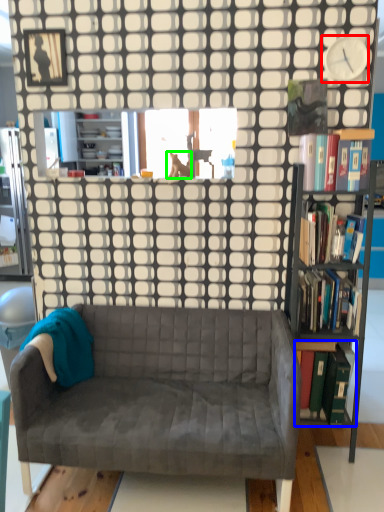
Question: Based on their relative distances, which object is farther from clock (highlighted by a red box)? Choose from book (highlighted by a blue box) and animal (highlighted by a green box).

Choices:
 (A) book
 (B) animal

Answer: (A)